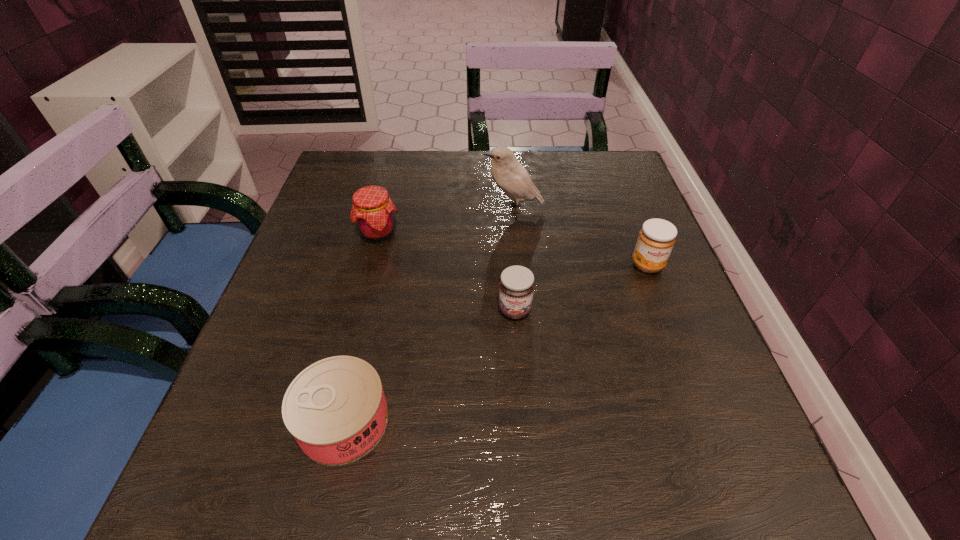
You are a GUI agent. You are given a task and a screenshot of the screen. Output one action in this format:
    pyautogui.click(x=<x>, y=<y>)
    Task: Click on the vacant region between the can and the farthest jam
    
    Given the screenshot: What is the action you would take?
    pyautogui.click(x=361, y=327)

At what (x,y) coordinates should I click in order to perform the action: click on vacant area that lies between the fourth nearest object and the can. Please return your answer as a coordinate pair (x, y). The width and height of the screenshot is (960, 540). Looking at the image, I should click on (361, 327).

What are the coordinates of `vacant space in between the nearest object and the third farthest object` in the screenshot? It's located at (495, 343).

At what (x,y) coordinates should I click in order to perform the action: click on vacant space that is in between the rightmost jam and the leftmost jam. Please return your answer as a coordinate pair (x, y). The height and width of the screenshot is (540, 960). Looking at the image, I should click on (513, 249).

Locate an element on the screen. The height and width of the screenshot is (540, 960). empty location between the nearest jam and the farthest object is located at coordinates (514, 259).

The height and width of the screenshot is (540, 960). I want to click on vacant space in between the nearest object and the leftmost jam, so click(361, 327).

Image resolution: width=960 pixels, height=540 pixels. I want to click on free space between the nearest jam and the farthest jam, so click(446, 272).

Locate an element on the screen. The height and width of the screenshot is (540, 960). free spot between the second jam from right to left and the fourth nearest object is located at coordinates (446, 272).

Locate an element on the screen. This screenshot has height=540, width=960. empty location between the nearest object and the third nearest object is located at coordinates (495, 343).

At what (x,y) coordinates should I click in order to perform the action: click on the closest object to the fourth farthest object. Please return your answer as a coordinate pair (x, y). This screenshot has height=540, width=960. Looking at the image, I should click on (336, 410).